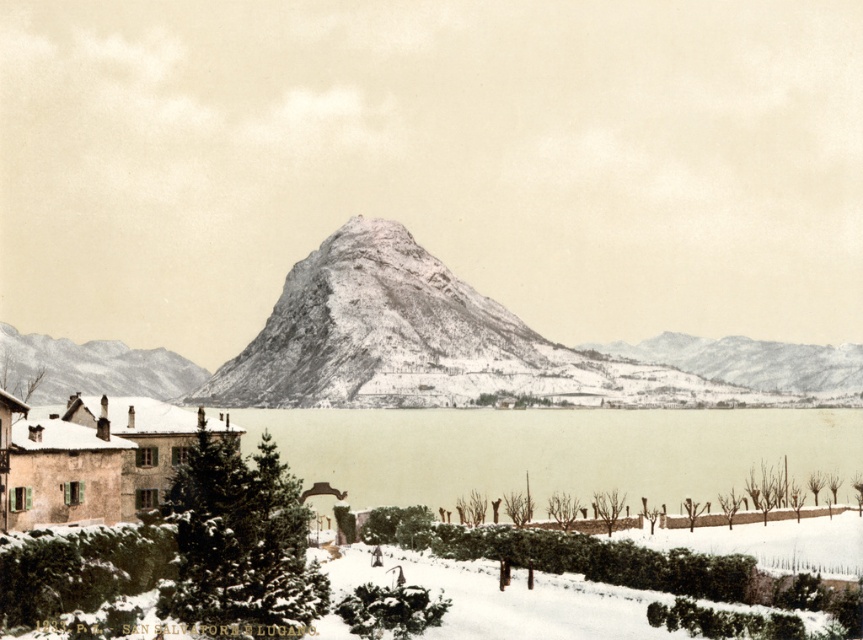
You are an architect planning to build a cabin in the area. You want to ensure it has a view of both the gray textured mountain at center and the snowy rocky mountain at left. Based on their heights, which mountain will appear larger in the cabin window?

The snowy rocky mountain at left appears larger in the cabin window because it is taller than the gray textured mountain at center.

You are a hiker planning to take a photo of the gray textured mountain at center from a specific location. If your camera can only focus on objects within a 0.5 unit radius centered at point A, which is at coordinates 0.5, 0.8, would the mountain be in focus?

The gray textured mountain at center is located at point (754, 364). The distance from point A (690, 320) to the mountain is sqrt. The mountain is within the 0.5 unit radius, so it would be in focus.

You are an architect planning to build a cabin in the winter landscape. The cabin needs to be visible from both the gray textured mountain at center and the snowy rocky mountain at left. Which mountain should you choose as the vantage point for the best visibility?

The snowy rocky mountain at left is larger than the gray textured mountain at center, so choosing the snowy rocky mountain at left as the vantage point would provide a higher elevation and better visibility of both mountains and the surrounding area.